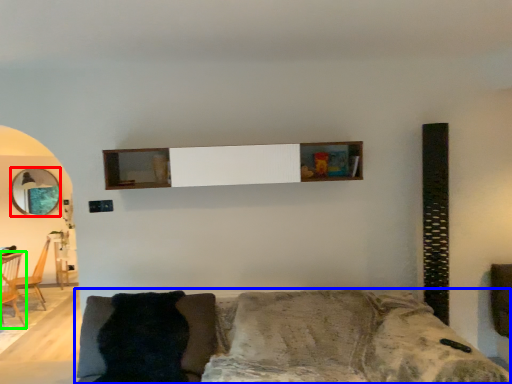
Question: Which object is positioned farthest from mirror (highlighted by a red box)? Select from studio couch (highlighted by a blue box) and armchair (highlighted by a green box).

Choices:
 (A) studio couch
 (B) armchair

Answer: (A)